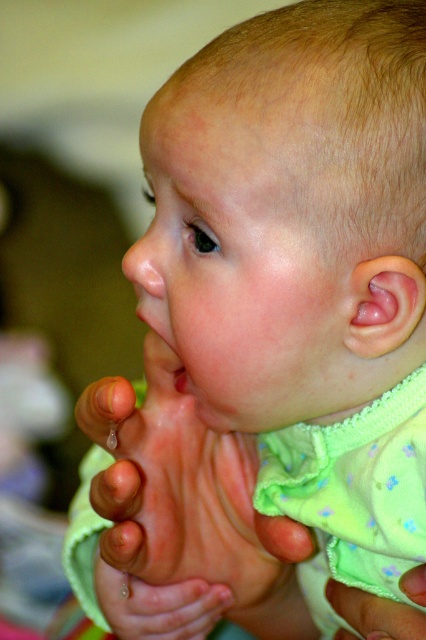
Question: Does pink smooth foot at center come behind green fabric hand at lower center?

Choices:
 (A) no
 (B) yes

Answer: (B)

Question: Can you confirm if pink smooth foot at center is bigger than green fabric hand at lower center?

Choices:
 (A) yes
 (B) no

Answer: (A)

Question: Can you confirm if pink smooth foot at center is thinner than green fabric hand at lower center?

Choices:
 (A) yes
 (B) no

Answer: (B)